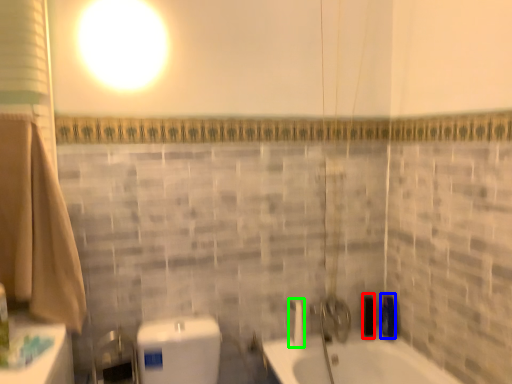
Question: Which object is positioned farthest from toiletry (highlighted by a red box)? Select from toiletry (highlighted by a blue box) and shower (highlighted by a green box).

Choices:
 (A) toiletry
 (B) shower

Answer: (B)